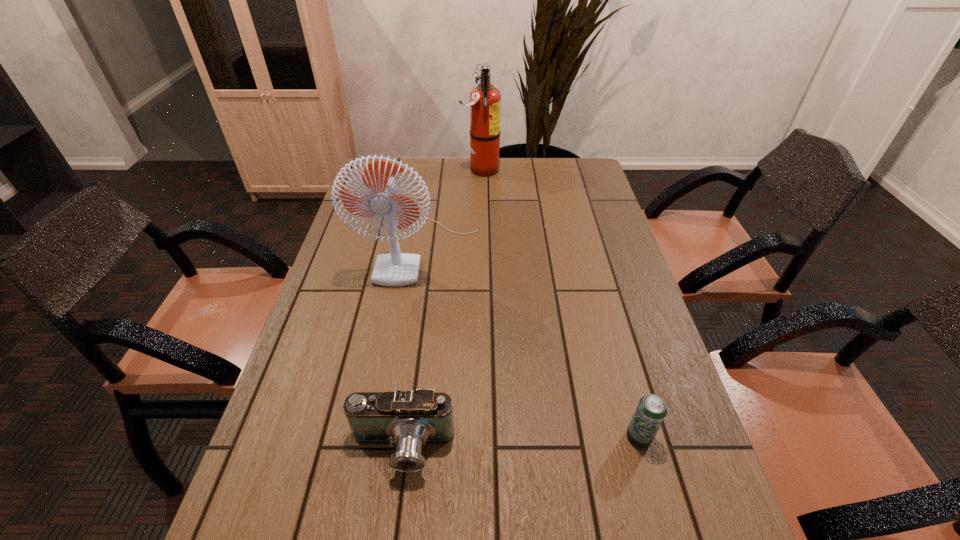
What are the coordinates of `the farthest object` in the screenshot? It's located at (485, 100).

You are a GUI agent. You are given a task and a screenshot of the screen. Output one action in this format:
    pyautogui.click(x=<x>, y=<y>)
    Task: Click on the fan
    
    Given the screenshot: What is the action you would take?
    pyautogui.click(x=394, y=269)

This screenshot has height=540, width=960. I want to click on beer can, so click(651, 410).

You are a GUI agent. You are given a task and a screenshot of the screen. Output one action in this format:
    pyautogui.click(x=<x>, y=<y>)
    Task: Click on the camcorder
    
    Given the screenshot: What is the action you would take?
    pyautogui.click(x=410, y=419)

Locate an element on the screen. blank space located from the nozzle of the fire extinguisher is located at coordinates (370, 170).

This screenshot has width=960, height=540. In order to click on blank space located from the nozzle of the fire extinguisher in this screenshot , I will do `click(393, 170)`.

Locate an element on the screen. This screenshot has height=540, width=960. vacant space situated from the nozzle of the fire extinguisher is located at coordinates (395, 170).

I want to click on free space located on the front-facing side of the fan, so click(402, 374).

You are a GUI agent. You are given a task and a screenshot of the screen. Output one action in this format:
    pyautogui.click(x=<x>, y=<y>)
    Task: Click on the free space located 0.190m on the left of the beer can
    
    Given the screenshot: What is the action you would take?
    pyautogui.click(x=536, y=437)

At what (x,y) coordinates should I click in order to perform the action: click on object that is at the far edge. Please return your answer as a coordinate pair (x, y). Looking at the image, I should click on (485, 100).